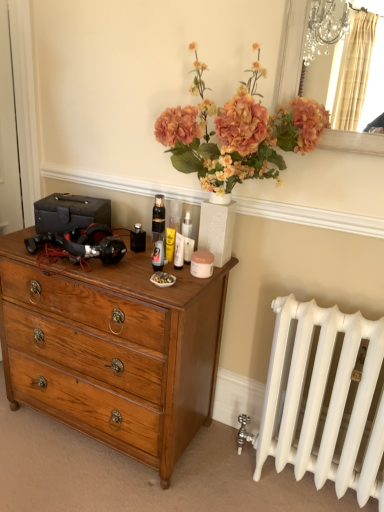
What do you see at coordinates (187, 237) in the screenshot?
I see `white glossy lotion at center` at bounding box center [187, 237].

Identify the location of wooden chest of drawers at left. This screenshot has height=512, width=384. (113, 349).

This screenshot has width=384, height=512. Identify the location of silver/metallic mirror at upper right. (352, 88).

At what (x,y) coordinates should I click in order to perform the action: click on white glossy lotion at center. Please return your answer as a coordinate pair (x, y). Image resolution: width=384 pixels, height=512 pixels. Looking at the image, I should click on (187, 237).

The width and height of the screenshot is (384, 512). I want to click on toiletry behind the silver/metallic mirror at upper right, so click(x=187, y=237).

Between silver/metallic mirror at upper right and white glossy lotion at center, which one has larger size?

Bigger between the two is silver/metallic mirror at upper right.

Considering the positions of objects silver/metallic mirror at upper right and white glossy lotion at center in the image provided, who is more to the right, silver/metallic mirror at upper right or white glossy lotion at center?

From the viewer's perspective, silver/metallic mirror at upper right appears more on the right side.

From the picture: Does silver/metallic mirror at upper right turn towards white glossy lotion at center?

No.

From a real-world perspective, is wooden chest of drawers at left below silver/metallic mirror at upper right?

Indeed, from a real-world perspective, wooden chest of drawers at left is positioned beneath silver/metallic mirror at upper right.

Considering the relative sizes of wooden chest of drawers at left and silver/metallic mirror at upper right in the image provided, is wooden chest of drawers at left wider than silver/metallic mirror at upper right?

Yes.

You are a GUI agent. You are given a task and a screenshot of the screen. Output one action in this format:
    pyautogui.click(x=<x>, y=<y>)
    Task: Click on the chest of drawers located on the left of silver/metallic mirror at upper right
    This screenshot has height=512, width=384.
    Given the screenshot: What is the action you would take?
    pyautogui.click(x=113, y=349)

Does wooden chest of drawers at left turn towards white glossy lotion at center?

No, wooden chest of drawers at left is not facing towards white glossy lotion at center.

Is wooden chest of drawers at left taller or shorter than white glossy lotion at center?

Considering their sizes, wooden chest of drawers at left has more height than white glossy lotion at center.

Measure the distance between wooden chest of drawers at left and white glossy lotion at center.

wooden chest of drawers at left and white glossy lotion at center are 21.16 inches apart from each other.

Which is more distant, (x=148, y=289) or (x=192, y=226)?

The point (x=192, y=226) is farther from the camera.

In terms of size, does white glossy lotion at center appear bigger or smaller than wooden chest of drawers at left?

In the image, white glossy lotion at center appears to be smaller than wooden chest of drawers at left.

Considering the positions of point (189, 234) and point (54, 344), is point (189, 234) closer or farther from the camera than point (54, 344)?

Point (189, 234) is positioned farther from the camera compared to point (54, 344).

Is wooden chest of drawers at left a part of white glossy lotion at center?

No, wooden chest of drawers at left is not inside white glossy lotion at center.

Is silver/metallic mirror at upper right not inside wooden chest of drawers at left?

That's correct, silver/metallic mirror at upper right is outside of wooden chest of drawers at left.

Is point (358, 23) farther from viewer compared to point (171, 403)?

No, (358, 23) is in front of (171, 403).

Who is taller, silver/metallic mirror at upper right or wooden chest of drawers at left?

Standing taller between the two is wooden chest of drawers at left.

From the image's perspective, is silver/metallic mirror at upper right below wooden chest of drawers at left?

Actually, silver/metallic mirror at upper right appears above wooden chest of drawers at left in the image.

What's the angular difference between white glossy lotion at center and silver/metallic mirror at upper right's facing directions?

The angle between the facing direction of white glossy lotion at center and the facing direction of silver/metallic mirror at upper right is 19.7 degrees.

Is white glossy lotion at center further to camera compared to silver/metallic mirror at upper right?

Yes.

I want to click on mirror above the white glossy lotion at center (from a real-world perspective), so click(x=352, y=88).

Would you say white glossy lotion at center is a long distance from silver/metallic mirror at upper right?

white glossy lotion at center is actually quite close to silver/metallic mirror at upper right.

Identify the location of toiletry below the silver/metallic mirror at upper right (from the image's perspective). (187, 237).

Image resolution: width=384 pixels, height=512 pixels. In order to click on mirror that appears above the wooden chest of drawers at left (from the image's perspective) in this screenshot , I will do point(352,88).

Which object lies further to the anchor point silver/metallic mirror at upper right, white glossy lotion at center or wooden chest of drawers at left?

The object further to silver/metallic mirror at upper right is wooden chest of drawers at left.

Estimate the real-world distances between objects in this image. Which object is closer to white glossy lotion at center, wooden chest of drawers at left or silver/metallic mirror at upper right?

Based on the image, wooden chest of drawers at left appears to be nearer to white glossy lotion at center.

Looking at the image, which one is located closer to wooden chest of drawers at left, silver/metallic mirror at upper right or white glossy lotion at center?

Based on the image, white glossy lotion at center appears to be nearer to wooden chest of drawers at left.

Looking at the image, which one is located closer to wooden chest of drawers at left, white glossy lotion at center or silver/metallic mirror at upper right?

white glossy lotion at center lies closer to wooden chest of drawers at left than the other object.

Considering their positions, is silver/metallic mirror at upper right positioned further to white glossy lotion at center than wooden chest of drawers at left?

Among the two, silver/metallic mirror at upper right is located further to white glossy lotion at center.

From the image, which object appears to be farther from silver/metallic mirror at upper right, wooden chest of drawers at left or white glossy lotion at center?

wooden chest of drawers at left is further to silver/metallic mirror at upper right.

Locate an element on the screen. toiletry that lies between silver/metallic mirror at upper right and wooden chest of drawers at left from top to bottom is located at coordinates (187, 237).